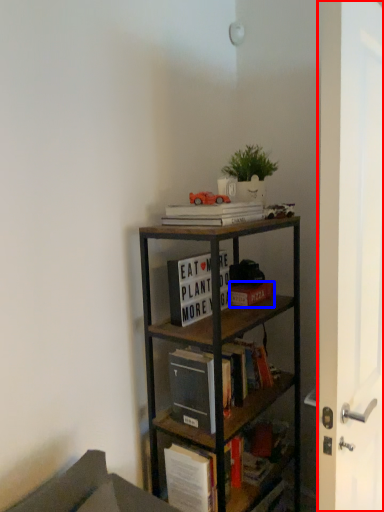
Question: Which object is further to the camera taking this photo, glass door (highlighted by a red box) or book (highlighted by a blue box)?

Choices:
 (A) glass door
 (B) book

Answer: (B)